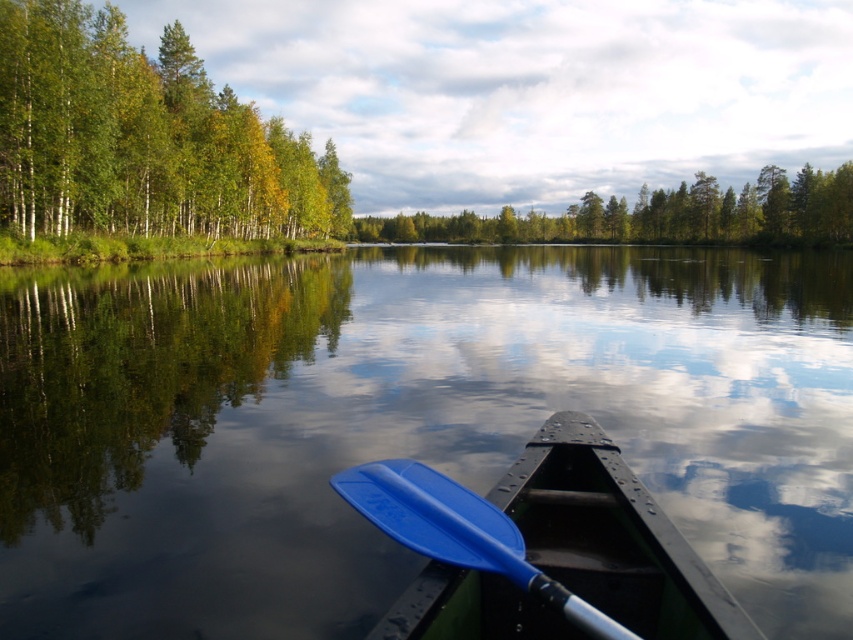
Does green matte trees at left have a lesser height compared to blue plastic paddle at lower center?

In fact, green matte trees at left may be taller than blue plastic paddle at lower center.

The height and width of the screenshot is (640, 853). Identify the location of green matte trees at left. pyautogui.click(x=143, y=138).

At what (x,y) coordinates should I click in order to perform the action: click on green matte trees at left. Please return your answer as a coordinate pair (x, y). The width and height of the screenshot is (853, 640). Looking at the image, I should click on (143, 138).

Does green matte tree at center have a greater width compared to blue plastic paddle at lower center?

Yes.

From the picture: Is green matte tree at center to the right of blue plastic paddle at lower center from the viewer's perspective?

Yes, green matte tree at center is to the right of blue plastic paddle at lower center.

Where is `green matte tree at center`? green matte tree at center is located at coordinates click(659, 216).

I want to click on green matte tree at center, so click(659, 216).

Can you confirm if transparent water at center is taller than green matte trees at left?

In fact, transparent water at center may be shorter than green matte trees at left.

Is transparent water at center to the left of green matte trees at left from the viewer's perspective?

No, transparent water at center is not to the left of green matte trees at left.

The height and width of the screenshot is (640, 853). What do you see at coordinates (404, 422) in the screenshot? I see `transparent water at center` at bounding box center [404, 422].

The image size is (853, 640). I want to click on transparent water at center, so pos(404,422).